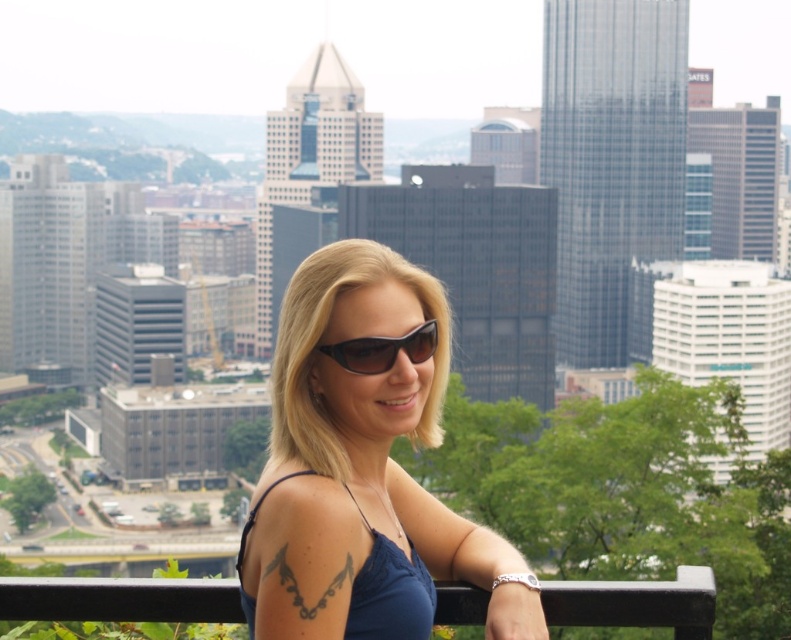
Does matte blue tank top at center appear over black metal balustrade at lower center?

Yes, matte blue tank top at center is above black metal balustrade at lower center.

Which is in front, point (290, 490) or point (653, 604)?

Positioned in front is point (290, 490).

The height and width of the screenshot is (640, 791). Describe the element at coordinates (362, 465) in the screenshot. I see `matte blue tank top at center` at that location.

Where is `matte blue tank top at center`? The height and width of the screenshot is (640, 791). matte blue tank top at center is located at coordinates (362, 465).

Can you confirm if blue fabric dress at center is positioned below black plastic sunglasses at center?

Yes.

Is blue fabric dress at center wider than black plastic sunglasses at center?

Yes.

You are a GUI agent. You are given a task and a screenshot of the screen. Output one action in this format:
    pyautogui.click(x=<x>, y=<y>)
    Task: Click on the blue fabric dress at center
    This screenshot has height=640, width=791.
    Given the screenshot: What is the action you would take?
    pyautogui.click(x=388, y=593)

At what (x,y) coordinates should I click in order to perform the action: click on blue fabric dress at center. Please return your answer as a coordinate pair (x, y). This screenshot has height=640, width=791. Looking at the image, I should click on (388, 593).

Does matte blue tank top at center appear on the right side of blue fabric dress at center?

Correct, you'll find matte blue tank top at center to the right of blue fabric dress at center.

Measure the distance between matte blue tank top at center and camera.

2105.19 feet

Find the location of `matte blue tank top at center`. matte blue tank top at center is located at coordinates (362, 465).